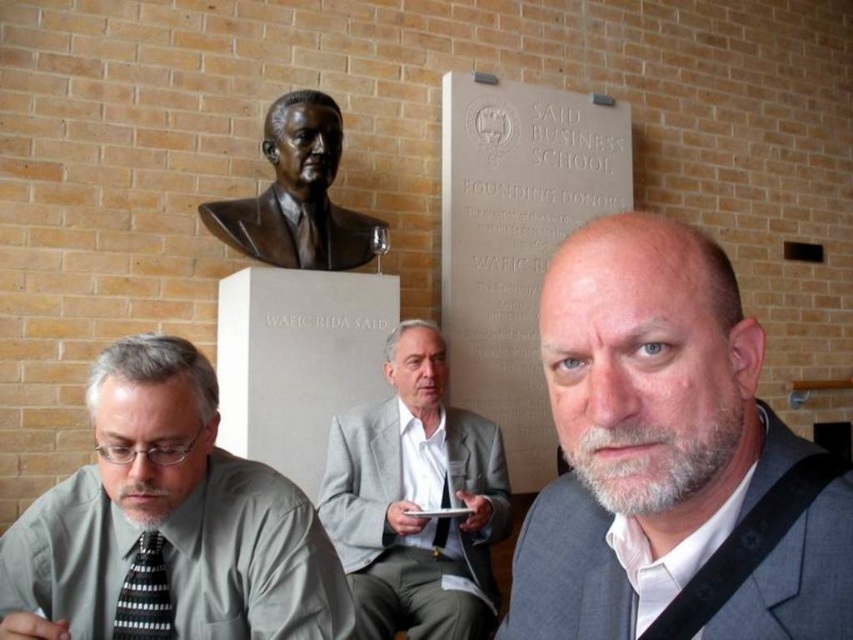
You are organizing a photo shoot in this scene and need to ensure that the gray matte shirt at lower left and the gray wool suit at center are visible in the frame. Based on their heights, which one might require you to adjust the camera angle to capture fully?

The gray matte shirt at lower left is shorter than the gray wool suit at center, so the gray wool suit at center may require a lower camera angle to ensure it is fully captured in the frame.

You are a photographer standing at the camera position. You want to focus on the gray matte shirt at lower left. What is the minimum distance you need to move forward to ensure the shirt is within your camera frame?

The gray matte shirt at lower left is 1.04 meters away from the camera. To ensure it is within the frame, you need to move forward until the distance is less than or equal to the camera lens focal length. However, without knowing the focal length or sensor size, the exact distance cannot be determined. The shirt is currently 1.04 meters away.